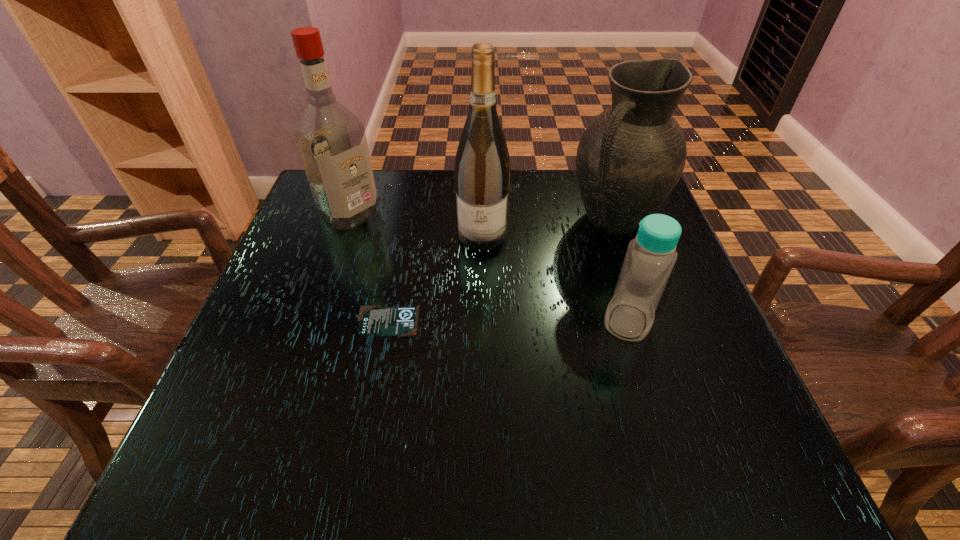
Choose which object is the fourth nearest neighbor to the pitcher. Please provide its 2D coordinates. Your answer should be formatted as a tuple, i.e. [(x, y)], where the tuple contains the x and y coordinates of a point satisfying the conditions above.

[(331, 140)]